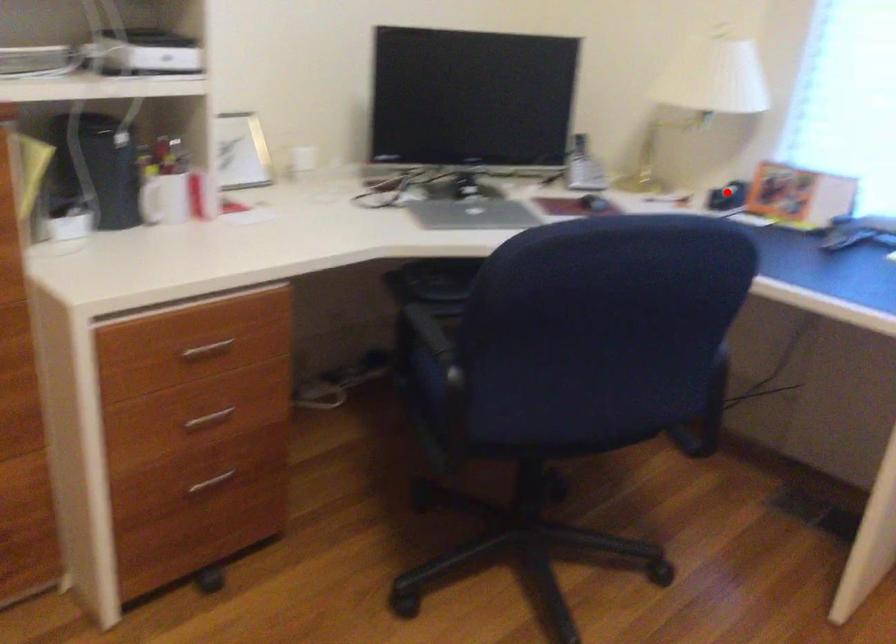
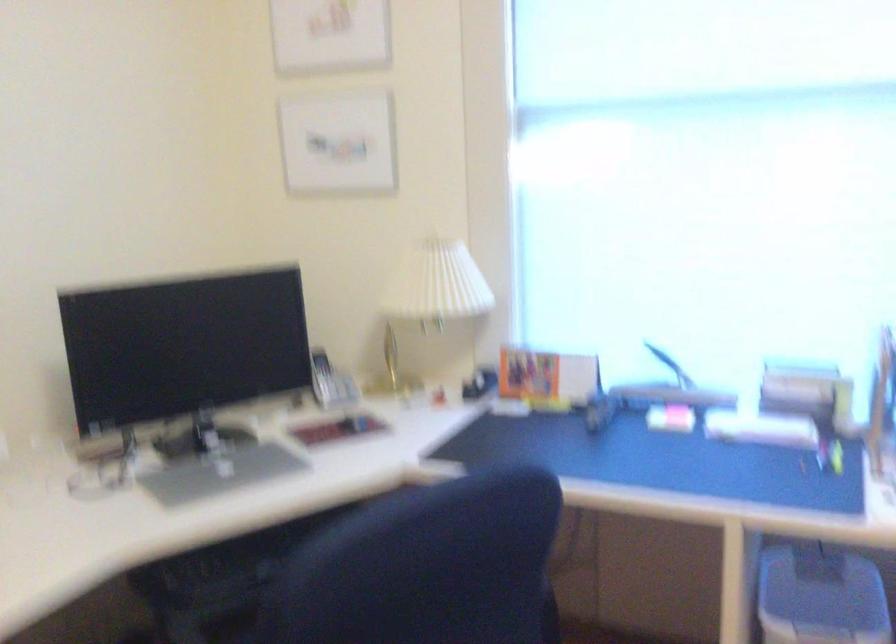
In the second image, find the point that corresponds to the highlighted location in the first image.

(479, 383)